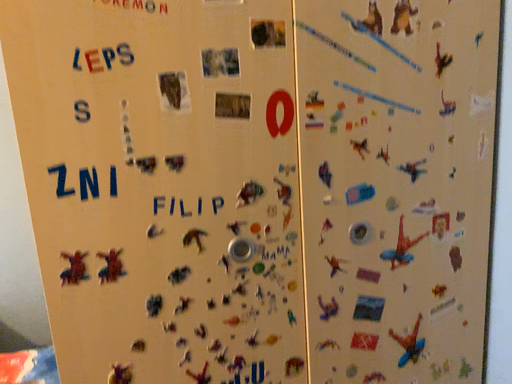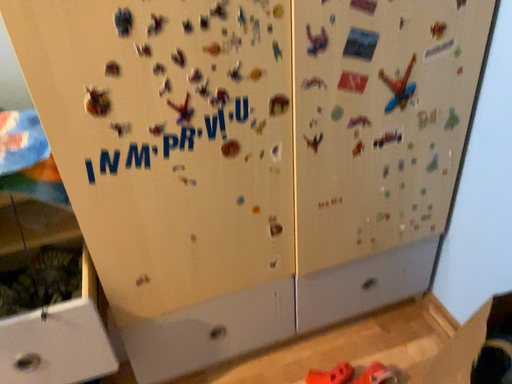
Question: How did the camera likely rotate when shooting the video?

Choices:
 (A) rotated upward
 (B) rotated downward

Answer: (B)